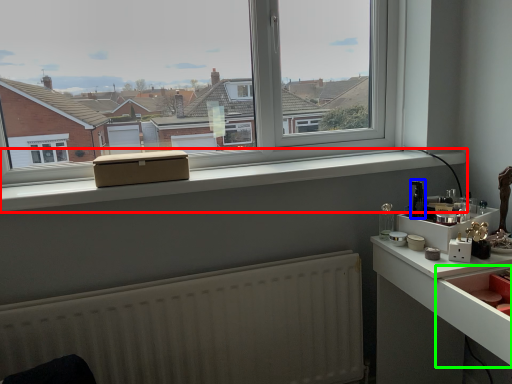
Question: Which is farther away from window sill (highlighted by a red box)? appliance (highlighted by a blue box) or drawer (highlighted by a green box)?

Choices:
 (A) appliance
 (B) drawer

Answer: (B)